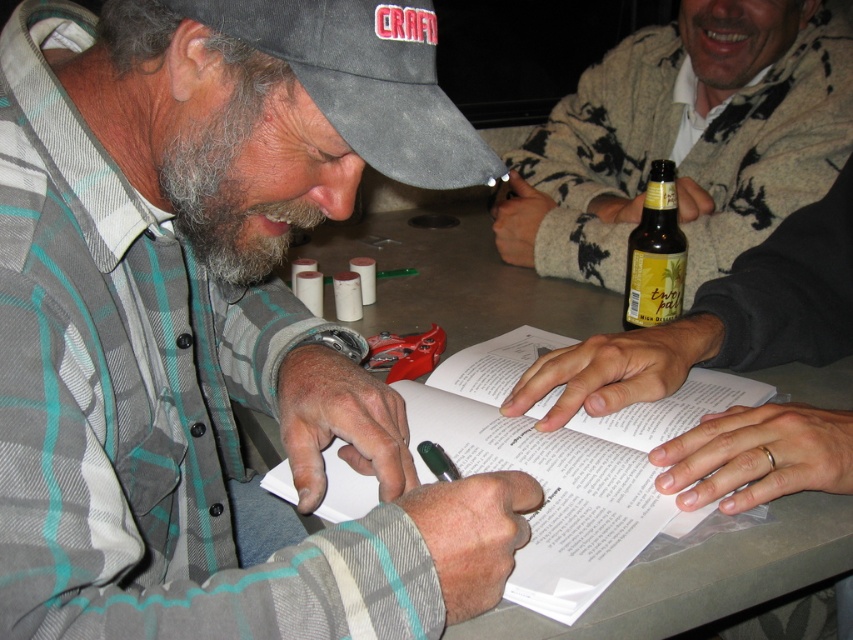
Based on the scene description, what are the coordinates of the plaid flannel shirt at center?

The plaid flannel shirt at center is located at coordinates point (213, 323).

Based on the photo, based on the scene described, which object is positioned lower in the image? The plaid flannel shirt at center or the graywoollybeard at left?

The plaid flannel shirt at center is located below graywoollybeard at left, so it is positioned lower in the image.

You are standing at the center of the image. Which object from the beige sweater at upper right is located to your right side?

The beige sweater at upper right is located to your right side.